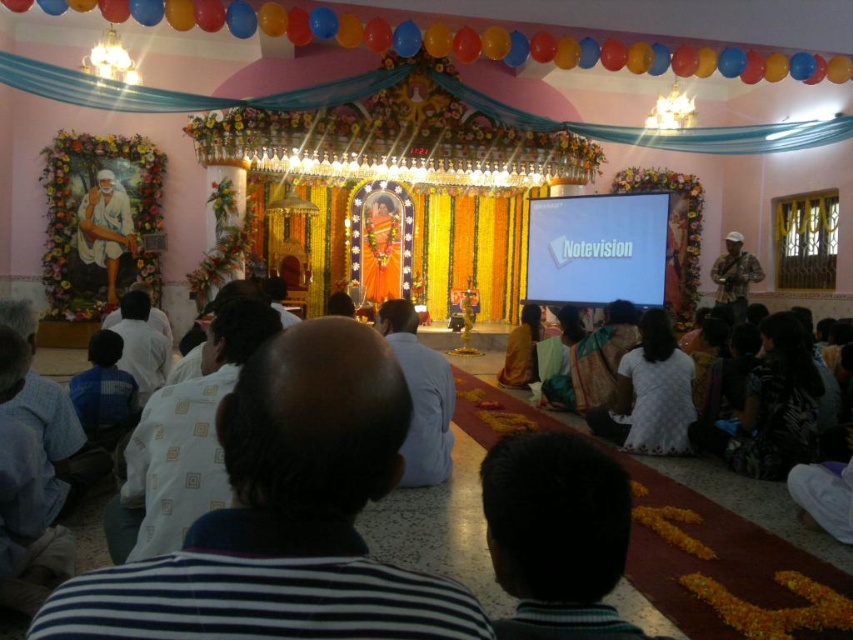
Question: Which point is farther to the camera?

Choices:
 (A) [122, 198]
 (B) [755, 273]

Answer: (B)

Question: Can you confirm if white clothed figure at left is positioned to the left of camouflage fabric shirt at right?

Choices:
 (A) no
 (B) yes

Answer: (B)

Question: Can you confirm if white clothed figure at left is positioned to the left of camouflage fabric shirt at right?

Choices:
 (A) no
 (B) yes

Answer: (B)

Question: Is white clothed figure at left bigger than camouflage fabric shirt at right?

Choices:
 (A) no
 (B) yes

Answer: (A)

Question: Which point is closer to the camera?

Choices:
 (A) camouflage fabric shirt at right
 (B) white clothed figure at left

Answer: (B)